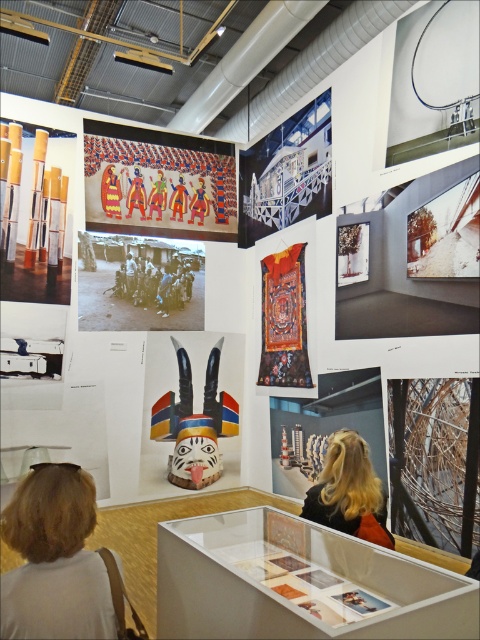
You are an art student analyzing the layout of the exhibition. You notice the vivid painted figures at upper center and the black and white photograph of people at center. Which of these two exhibits is taller?

The vivid painted figures at upper center is taller than the black and white photograph of people at center according to the description provided.

You are standing in the gallery and want to take a closer look at the artifact located at point (x=346, y=500). If your maximum reach is 1.8 meters, can you touch it without moving closer?

The distance between you and the artifact at point (x=346, y=500) is 2.02 meters, which is beyond your maximum reach of 1.8 meters. Therefore, you cannot touch it without moving closer.

You are an art student standing in the exhibition space. You see the wooden painted mask at center and the velvet tapestry at center. Which one is positioned to the left?

The wooden painted mask at center is positioned to the left of the velvet tapestry at center.